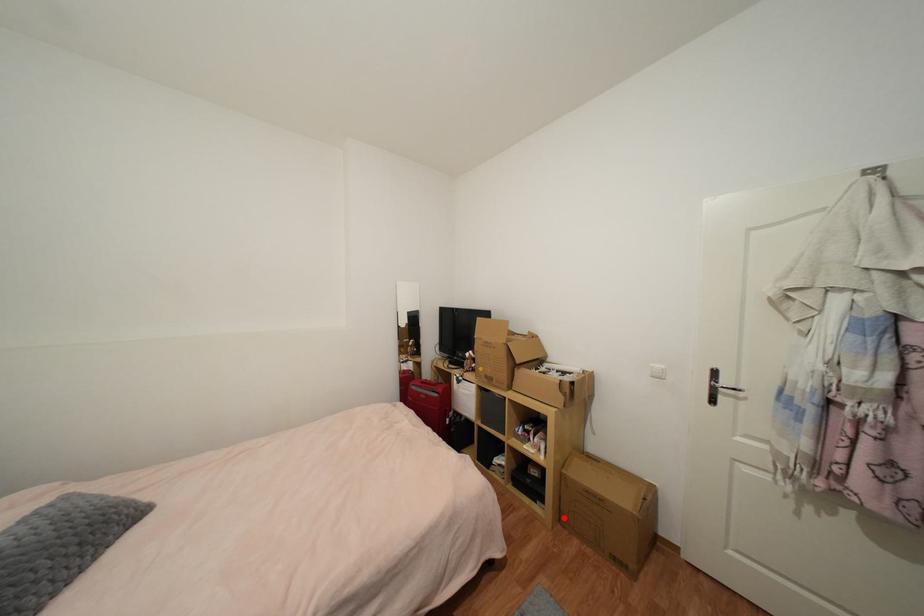
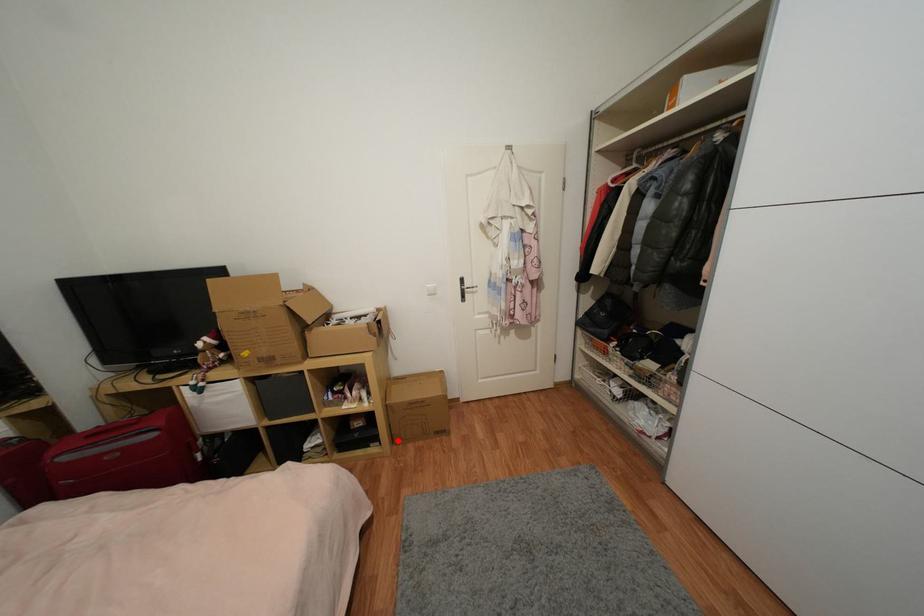
I am providing you with two images of the same scene from different viewpoints. A red point is marked on the first image and another point is marked on the second image. Does the point marked in image1 correspond to the same location as the one in image2?

Yes